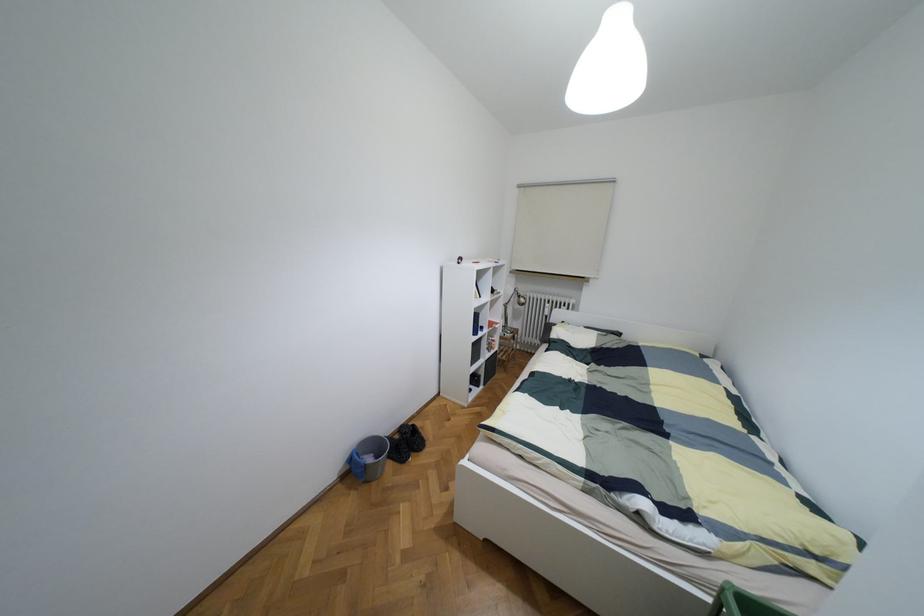
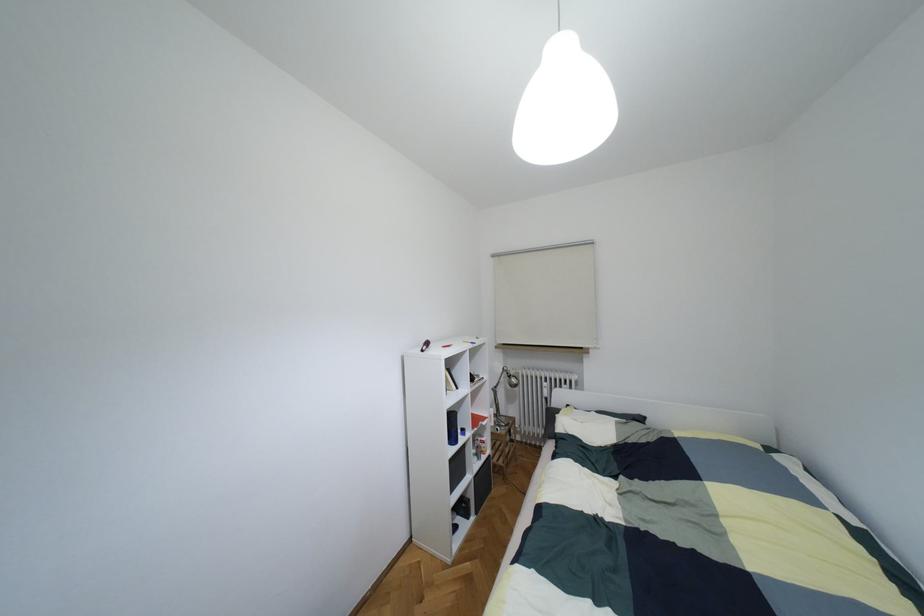
Locate, in the second image, the point that corresponds to pixel 517 296 in the first image.

(508, 376)